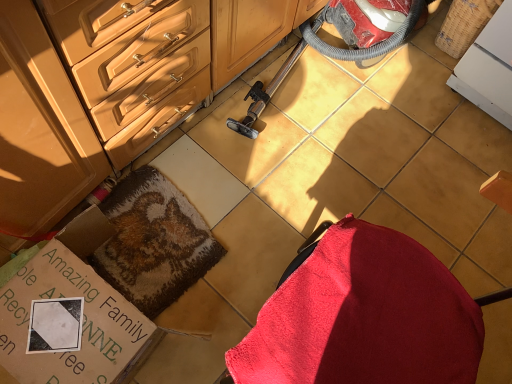
Question: Is point (x=184, y=268) closer or farther from the camera than point (x=335, y=11)?

Choices:
 (A) farther
 (B) closer

Answer: (B)

Question: Is fluffy brown rug at center inside the boundaries of red plastic vacuum cleaner at center, or outside?

Choices:
 (A) outside
 (B) inside

Answer: (A)

Question: Considering the real-world distances, which object is farthest from the matte wood cabinetry at center?

Choices:
 (A) velvet red swivel chair at center
 (B) fluffy brown rug at center
 (C) red plastic vacuum cleaner at center
 (D) cardboard box at lower left

Answer: (A)

Question: Which is nearer to the matte wood cabinetry at center?

Choices:
 (A) velvet red swivel chair at center
 (B) fluffy brown rug at center
 (C) cardboard box at lower left
 (D) red plastic vacuum cleaner at center

Answer: (B)